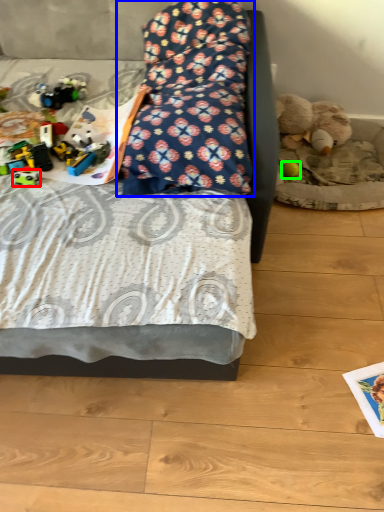
Question: Based on their relative distances, which object is nearer to toy (highlighted by a red box)? Choose from pillow (highlighted by a blue box) and toy (highlighted by a green box).

Choices:
 (A) pillow
 (B) toy

Answer: (A)